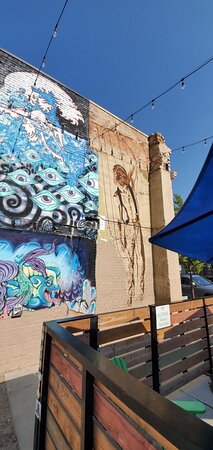
This screenshot has width=213, height=450. I want to click on string lights, so click(204, 144).